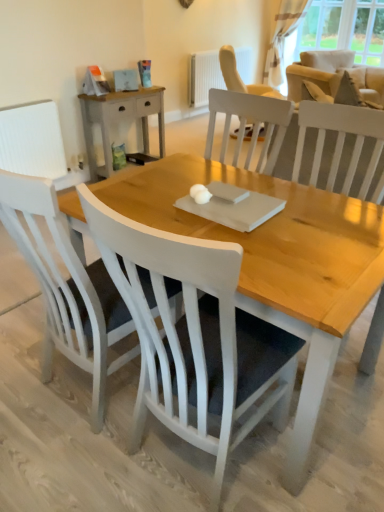
Locate an element on the screen. vacant space that is to the left of white matte chair at lower left, arranged as the 3th chair when viewed from the right is located at coordinates (18, 365).